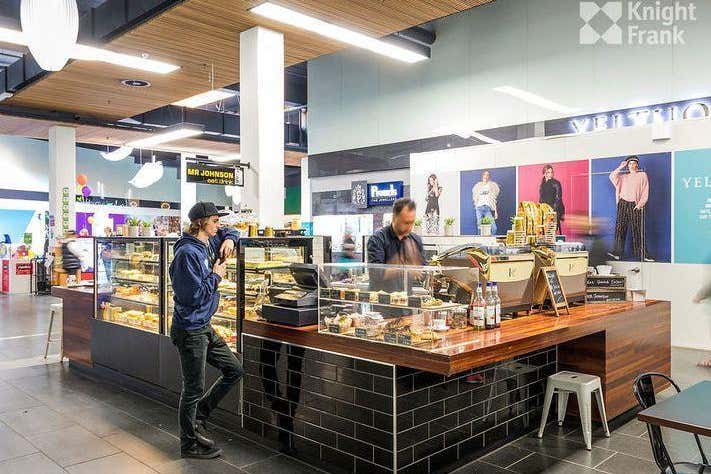
At what (x,y) coordinates should I click in order to perform the action: click on counter. Please return your answer as a coordinate pair (x, y). The height and width of the screenshot is (474, 711). Looking at the image, I should click on (525, 326), (87, 292).